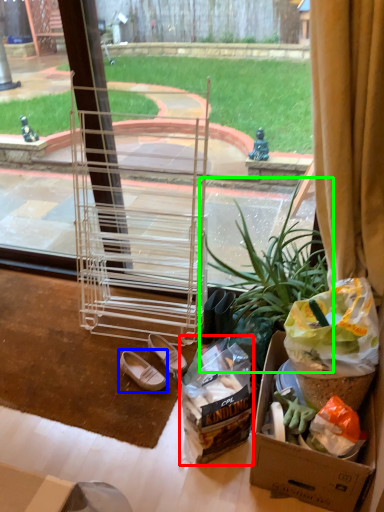
Question: Which is farther away from waste (highlighted by a red box)? footwear (highlighted by a blue box) or houseplant (highlighted by a green box)?

Choices:
 (A) footwear
 (B) houseplant

Answer: (A)